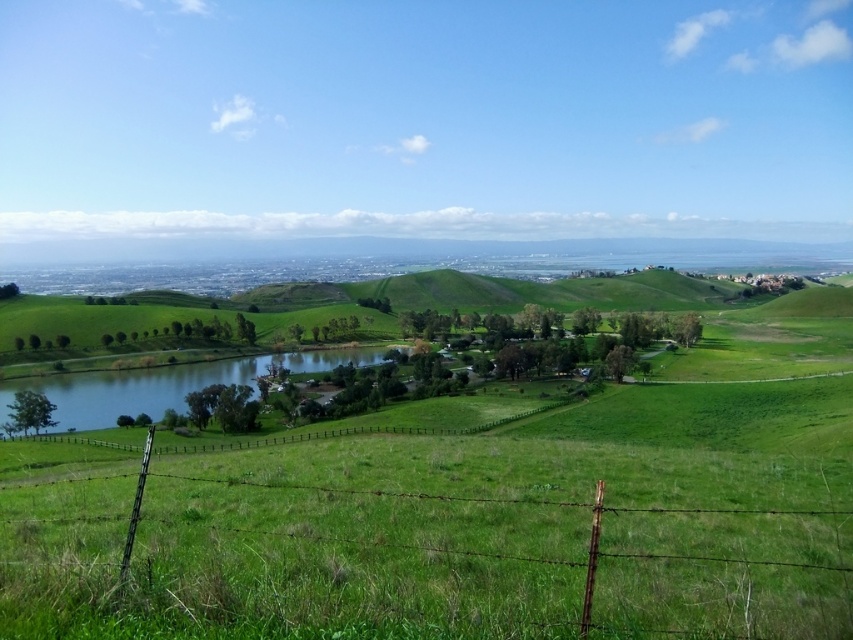
Question: In this image, where is green wire fence at lower center located relative to green grassy lake at center?

Choices:
 (A) above
 (B) below

Answer: (A)

Question: Does green wire fence at lower center lie in front of green grassy lake at center?

Choices:
 (A) no
 (B) yes

Answer: (B)

Question: Is the position of green wire fence at lower center less distant than that of green grassy lake at center?

Choices:
 (A) yes
 (B) no

Answer: (A)

Question: Which object is farther from the camera taking this photo?

Choices:
 (A) green grassy lake at center
 (B) green wire fence at lower center

Answer: (A)